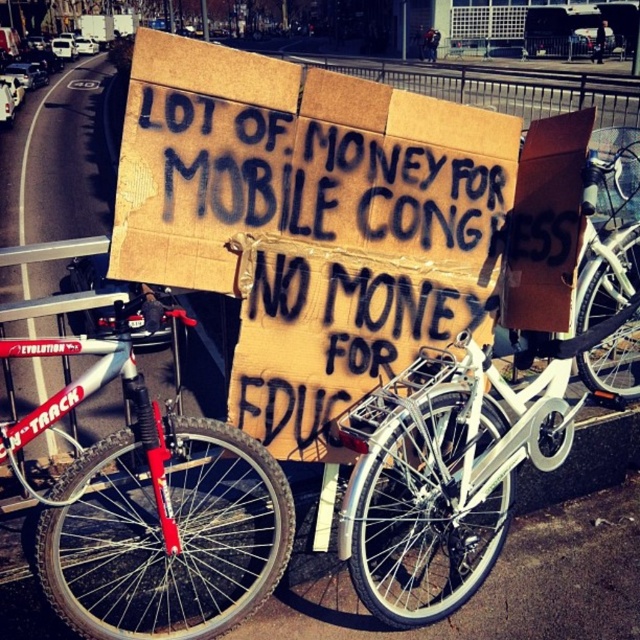
Question: Does red matte bicycle at left appear on the right side of white matte bicycle at center?

Choices:
 (A) yes
 (B) no

Answer: (B)

Question: Which object is closer to the camera taking this photo?

Choices:
 (A) white metallic bicycle at center
 (B) white matte bicycle at center
 (C) cardboard sign at center
 (D) red matte bicycle at left

Answer: (D)

Question: Which point appears farthest from the camera in this image?

Choices:
 (A) (605, 339)
 (B) (488, 566)
 (C) (237, 176)

Answer: (A)

Question: Is cardboard sign at center positioned at the back of white metallic bicycle at center?

Choices:
 (A) yes
 (B) no

Answer: (B)

Question: Based on their relative distances, which object is nearer to the white metallic bicycle at center?

Choices:
 (A) white matte bicycle at center
 (B) cardboard sign at center
 (C) red matte bicycle at left

Answer: (B)

Question: Considering the relative positions of cardboard sign at center and white metallic bicycle at center in the image provided, where is cardboard sign at center located with respect to white metallic bicycle at center?

Choices:
 (A) above
 (B) below

Answer: (A)